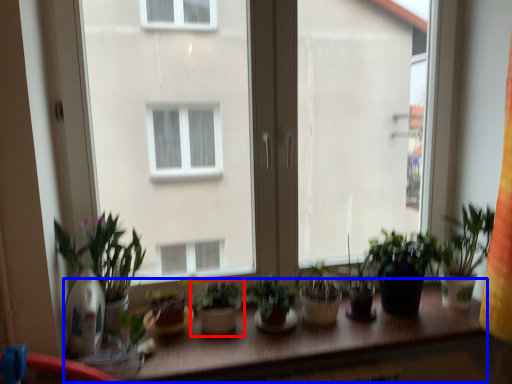
Question: Which object appears closest to the camera in this image, houseplant (highlighted by a red box) or table (highlighted by a blue box)?

Choices:
 (A) houseplant
 (B) table

Answer: (B)